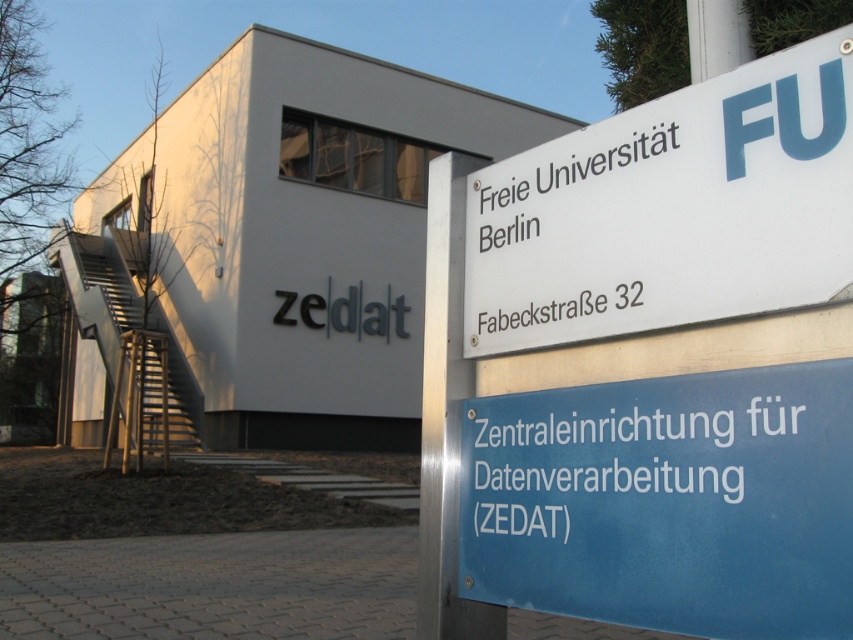
From the picture: You are standing in front of the building and want to read the text on the blue glossy sign at center. Can you reach it without moving closer?

The blue glossy sign at center is 4.36 feet from viewer, so yes, you can reach it without moving closer since it is within arm

What is the color of the sign located at the point marked by the coordinates (666, 500)?

The point at coordinates (666, 500) marks the blue glossy sign at center, so the color is blue.

You are standing in front of the building and want to read the blue glossy sign at center. Where should you look to find it?

The blue glossy sign at center is located at point [666,500], so you should look there to find it.